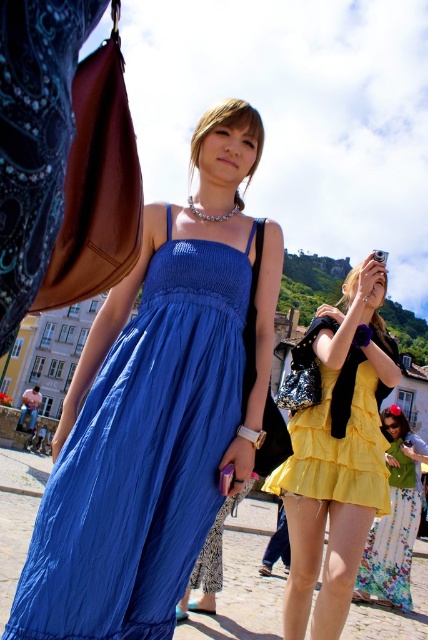
Is yellow satin dress at center taller than yellow floral skirt at lower right?

Indeed, yellow satin dress at center has a greater height compared to yellow floral skirt at lower right.

Is point (312, 468) positioned in front of point (389, 433)?

Yes, it is in front of point (389, 433).

Describe the element at coordinates (336, 456) in the screenshot. I see `yellow satin dress at center` at that location.

This screenshot has width=428, height=640. Identify the location of yellow satin dress at center. (336, 456).

Between matte blue dress at center and yellow satin dress at center, which one has less height?

matte blue dress at center

Measure the distance between point (124, 504) and camera.

Point (124, 504) is 20.08 meters from camera.

Is point (202, 300) less distant than point (297, 362)?

Yes, point (202, 300) is closer to viewer.

Where is `matte blue dress at center`? The width and height of the screenshot is (428, 640). matte blue dress at center is located at coordinates (142, 456).

Does point (148, 371) come closer to viewer compared to point (392, 582)?

Yes, point (148, 371) is closer to viewer.

Where is `matte blue dress at center`? matte blue dress at center is located at coordinates (142, 456).